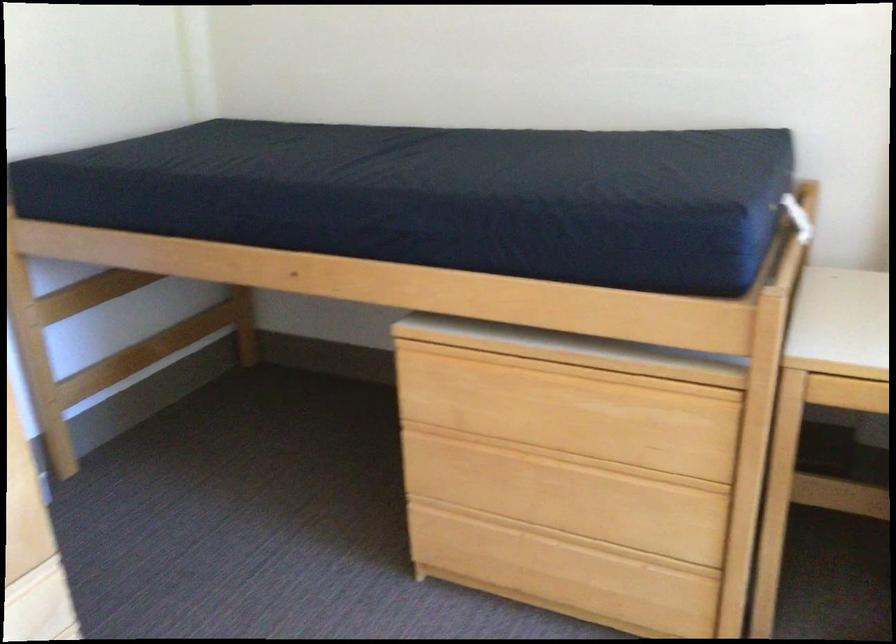
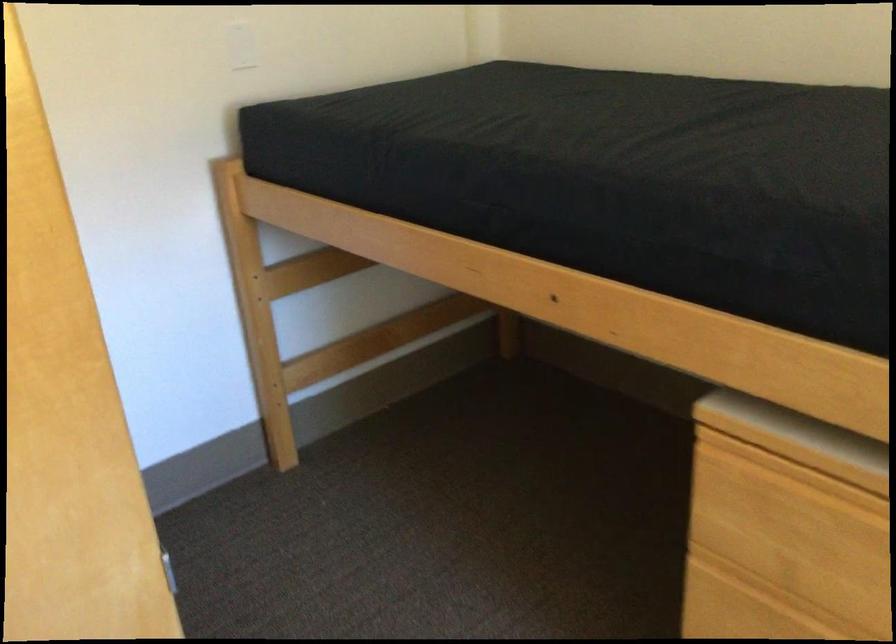
Question: What movement of the cameraman would produce the second image?

Choices:
 (A) Left
 (B) Right
 (C) Forward
 (D) Backward

Answer: (C)